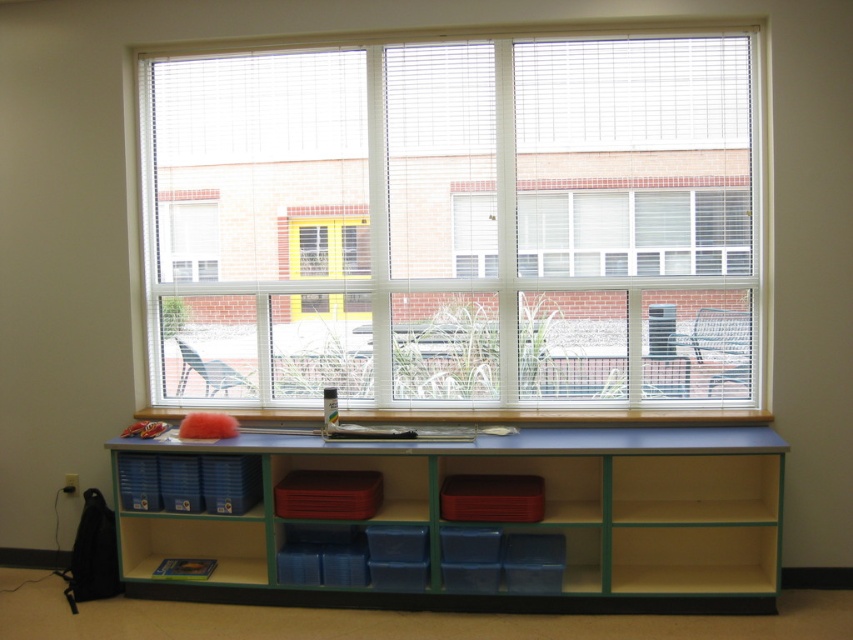
Question: Considering the real-world distances, which object is farthest from the blue plastic bookshelf at center?

Choices:
 (A) white plastic blinds at upper center
 (B) wooden at lower center

Answer: (A)

Question: Can you confirm if blue plastic bookshelf at center is smaller than wooden at lower center?

Choices:
 (A) yes
 (B) no

Answer: (B)

Question: Which object is the farthest from the white plastic blinds at upper center?

Choices:
 (A) blue plastic bookshelf at center
 (B) wooden at lower center

Answer: (A)

Question: Can you confirm if white plastic blinds at upper center is thinner than wooden at lower center?

Choices:
 (A) no
 (B) yes

Answer: (B)

Question: Is white plastic blinds at upper center above wooden at lower center?

Choices:
 (A) no
 (B) yes

Answer: (B)

Question: Which object appears farthest from the camera in this image?

Choices:
 (A) blue plastic bookshelf at center
 (B) white plastic blinds at upper center

Answer: (B)